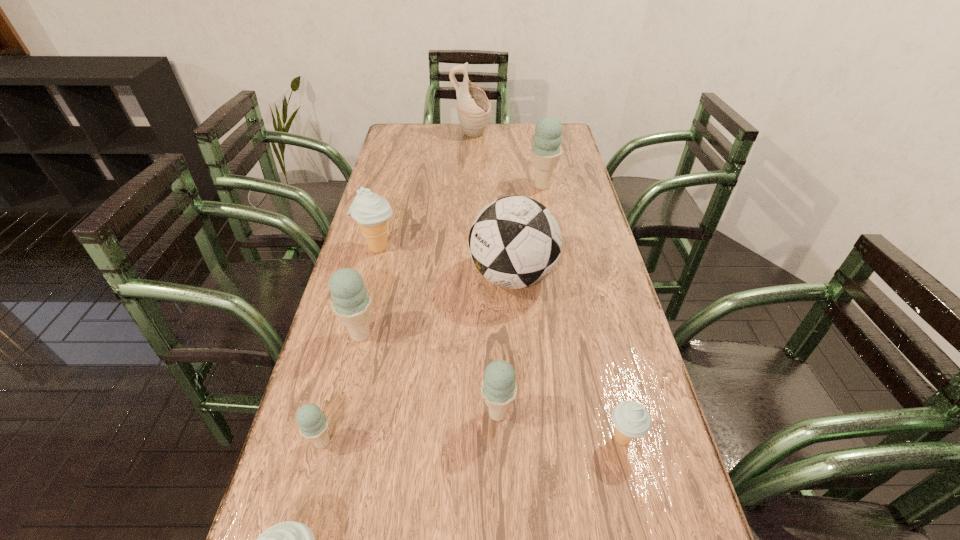
Locate an element on the screen. The width and height of the screenshot is (960, 540). unoccupied position between the second smallest blue ice cream and the second farthest blue ice cream is located at coordinates click(429, 374).

This screenshot has width=960, height=540. I want to click on blank region between the rightmost beige icecream and the second blue ice cream from right to left, so click(x=560, y=426).

Find the location of a particular element. The height and width of the screenshot is (540, 960). vacant area between the second nearest beige icecream and the smallest blue ice cream is located at coordinates (472, 441).

Locate an element on the screen. object that is the third closest to the pitcher is located at coordinates coord(515,242).

Choose which object is the third nearest neighbor to the second biggest blue ice cream. Please provide its 2D coordinates. Your answer should be formatted as a tuple, i.e. [(x, y)], where the tuple contains the x and y coordinates of a point satisfying the conditions above.

[(371, 212)]

In order to click on ice cream that is the third closest to the nearest ice cream in this screenshot , I will do `click(351, 302)`.

Locate which ice cream is the fifth closest to the second smallest blue ice cream. Please provide its 2D coordinates. Your answer should be formatted as a tuple, i.e. [(x, y)], where the tuple contains the x and y coordinates of a point satisfying the conditions above.

[(371, 212)]

At what (x,y) coordinates should I click in order to perform the action: click on blue ice cream that is the third closest to the pitcher. Please return your answer as a coordinate pair (x, y). This screenshot has height=540, width=960. Looking at the image, I should click on (498, 388).

Identify the location of blue ice cream that stands as the second closest to the soccer ball. This screenshot has width=960, height=540. (498, 388).

Find the location of a particular element. The width and height of the screenshot is (960, 540). beige icecream that stands as the closest to the sixth nearest ice cream is located at coordinates (631, 420).